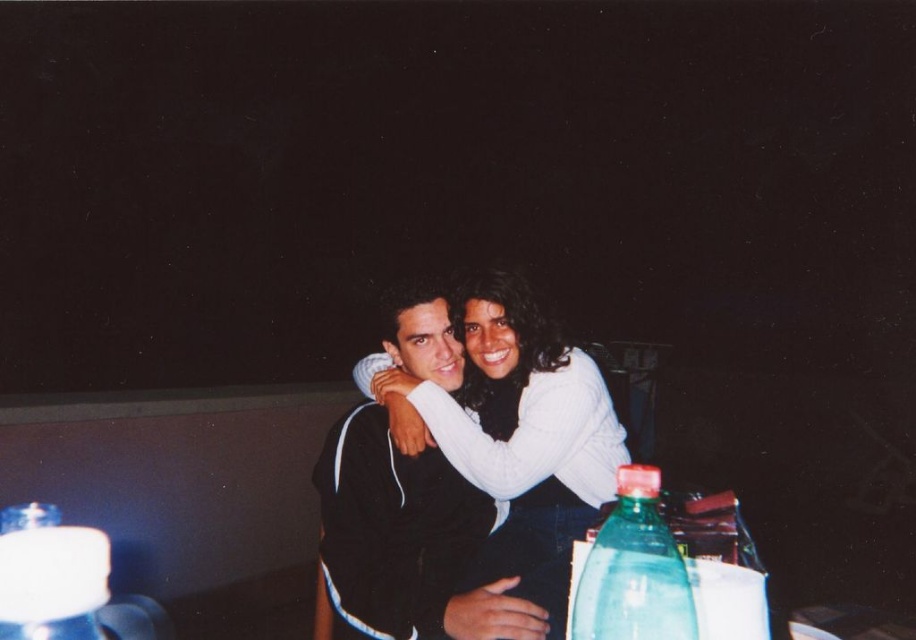
In the scene shown: Is black matte jacket at center to the left of translucent plastic bottle at lower left from the viewer's perspective?

No, black matte jacket at center is not to the left of translucent plastic bottle at lower left.

Describe the element at coordinates (405, 541) in the screenshot. The image size is (916, 640). I see `black matte jacket at center` at that location.

In order to click on black matte jacket at center in this screenshot , I will do `click(405, 541)`.

Is point (384, 483) closer to camera compared to point (675, 579)?

No, it is not.

Is point (389, 499) positioned before point (596, 604)?

That is False.

This screenshot has height=640, width=916. In order to click on black matte jacket at center in this screenshot , I will do `click(405, 541)`.

Does translucent plastic bottle at lower right have a larger size compared to translucent plastic bottle at lower left?

Yes, translucent plastic bottle at lower right is bigger than translucent plastic bottle at lower left.

Is point (591, 598) positioned after point (44, 522)?

Yes, it is behind point (44, 522).

Is point (626, 568) positioned in front of point (96, 552)?

No, (626, 568) is behind (96, 552).

Locate an element on the screen. Image resolution: width=916 pixels, height=640 pixels. translucent plastic bottle at lower right is located at coordinates (633, 570).